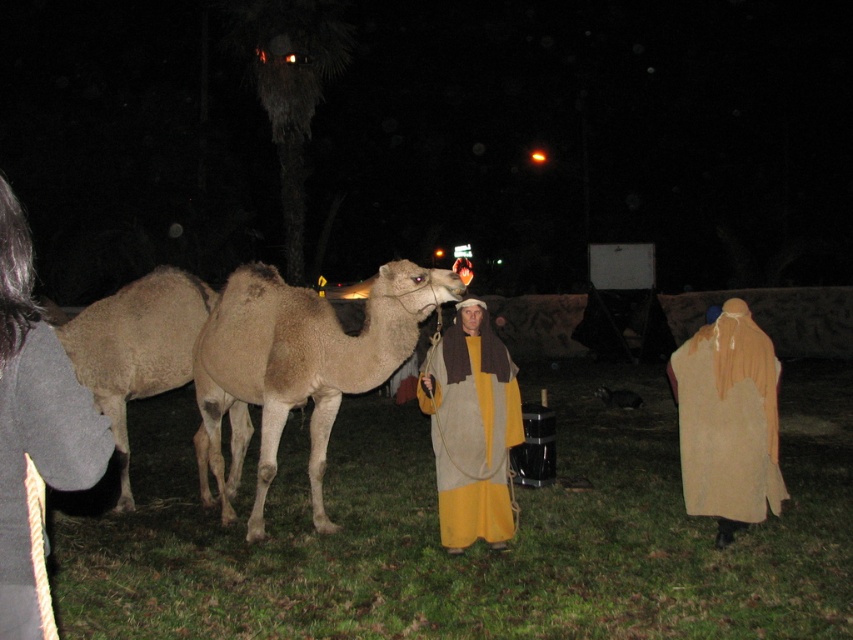
Question: Which of the following is the closest to the observer?

Choices:
 (A) beige cotton robe at lower left
 (B) beige fabric robe at right
 (C) light brown matte camel at center
 (D) beige woolen camel at left

Answer: (A)

Question: Which of these objects is positioned closest to the light brown matte camel at center?

Choices:
 (A) beige fabric robe at right
 (B) beige cotton robe at lower left
 (C) beige woolen camel at left
 (D) yellow woolen robe at center

Answer: (D)

Question: Is light brown matte camel at center positioned in front of beige cotton robe at lower left?

Choices:
 (A) yes
 (B) no

Answer: (B)

Question: Can you confirm if beige woolen camel at left is positioned above yellow woolen robe at center?

Choices:
 (A) yes
 (B) no

Answer: (A)

Question: Can you confirm if light brown matte camel at center is smaller than beige woolen camel at left?

Choices:
 (A) no
 (B) yes

Answer: (A)

Question: Which object is farther from the camera taking this photo?

Choices:
 (A) light brown matte camel at center
 (B) beige fabric robe at right
 (C) beige woolen camel at left
 (D) yellow woolen robe at center

Answer: (C)